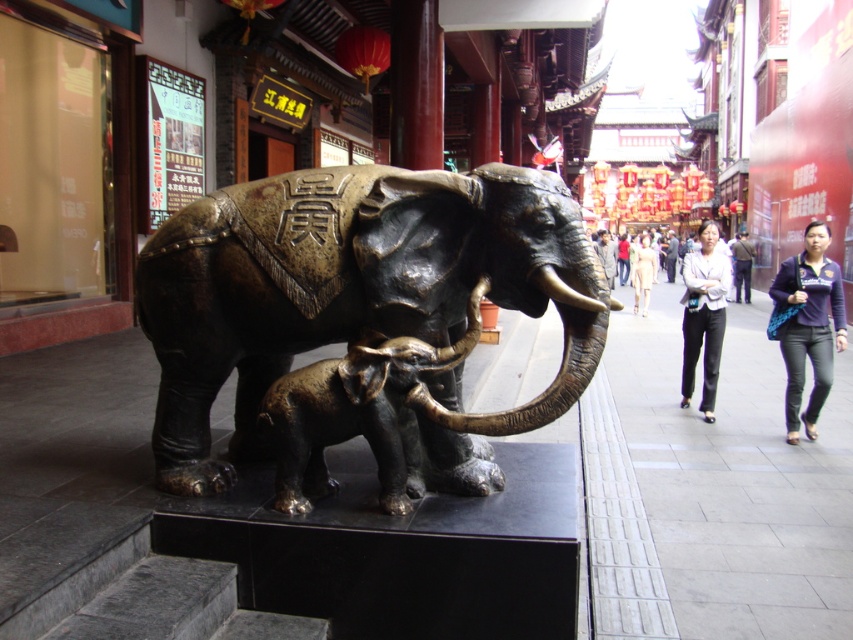
You are a delivery person who needs to place a heavy box on the gray concrete pavement at lower right. However, there is a gold metallic tusk at center nearby. Considering their heights, which object is higher and can support the box more securely?

The gray concrete pavement at lower right has a greater height compared to the gold metallic tusk at center, so it is higher and can support the box more securely.

You are a delivery person holding a package that is 1 meter long. You need to place it on the gray concrete pavement at lower right or the gold metallic tusk at center. Which surface can accommodate the package without it hanging off the edge?

The gray concrete pavement at lower right has a larger size compared to the gold metallic tusk at center, so the package can be placed on the gray concrete pavement at lower right without hanging off the edge.

You are standing in front of the bronze statue of two elephants. There are two points marked on the statue. One is at coordinate point (258, 285) and the other is at point (292, 483). Which point is closer to you?

Point (258, 285) is closer to the viewer than point (292, 483).